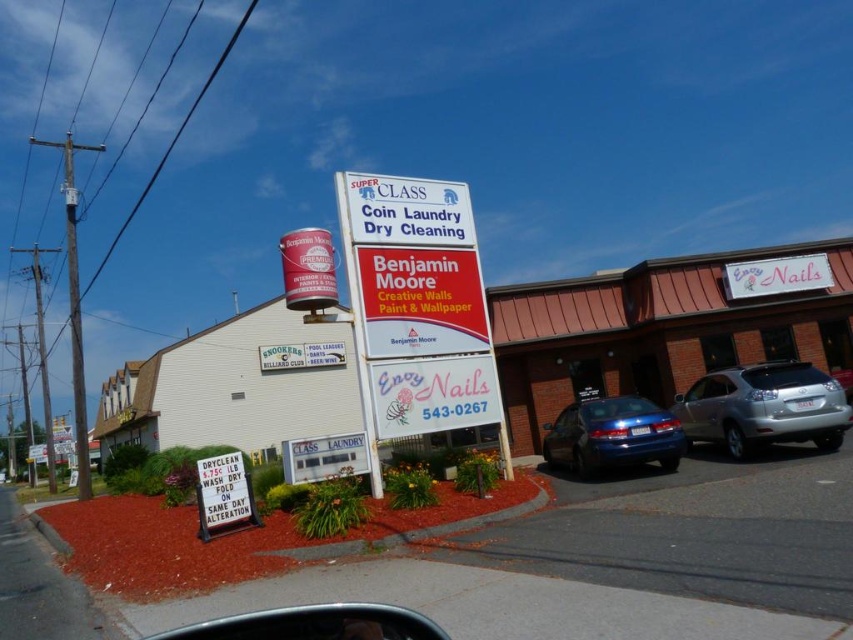
You are a pedestrian standing at the edge of the street looking towards the commercial area. You see a metallic silver car at center and a white glossy sign at upper right. Which object is positioned higher in the image?

The white glossy sign at upper right is positioned higher than the metallic silver car at center in the image.

Consider the image. You are a delivery person trying to park your 6.5 feet tall delivery van. You see a metallic silver car at center and a white glossy sign at upper right. Can you determine if the space between them is tall enough for your van?

The metallic silver car at center is taller than the white glossy sign at upper right. Since the van is 6.5 feet tall, you need to ensure the space between them can accommodate this height. However, without knowing the exact height of the car or the sign, it is uncertain if the space is sufficient.